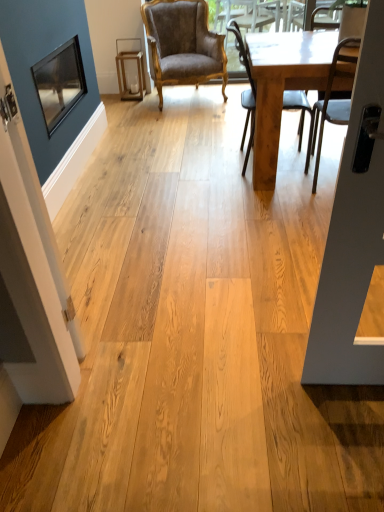
This screenshot has height=512, width=384. What are the coordinates of `free space that is in between metallic silver chair at right, the 3th chair from the left, and matte black screen door at left` in the screenshot? It's located at (235, 248).